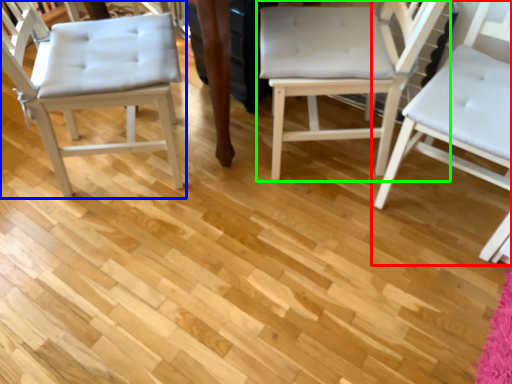
Question: Based on their relative distances, which object is farther from chair (highlighted by a red box)? Choose from chair (highlighted by a blue box) and chair (highlighted by a green box).

Choices:
 (A) chair
 (B) chair

Answer: (A)